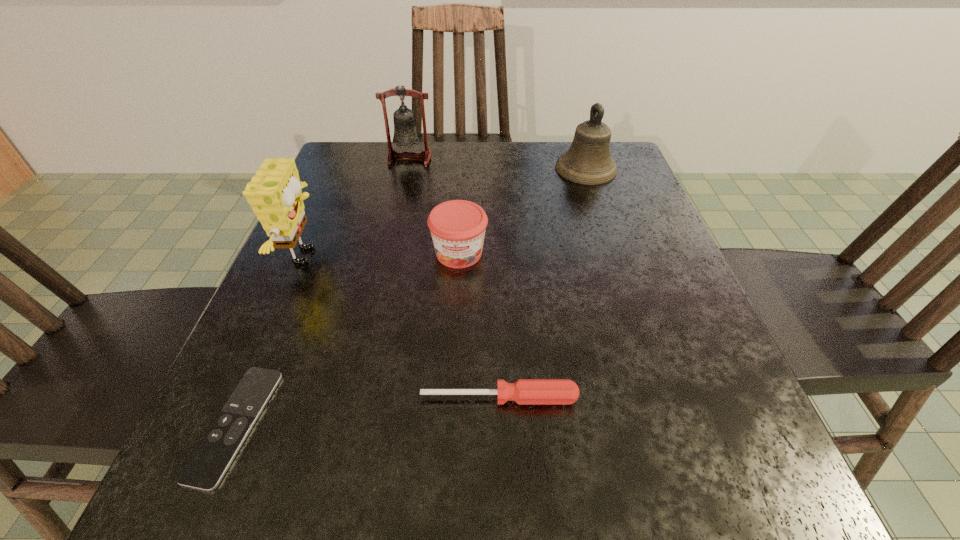
This screenshot has height=540, width=960. I want to click on the fourth object from right to left, so click(406, 134).

Identify the location of sponge. (274, 193).

Where is `the right bell`? the right bell is located at coordinates (588, 161).

Image resolution: width=960 pixels, height=540 pixels. Find the location of `jam`. jam is located at coordinates (457, 227).

This screenshot has height=540, width=960. Find the location of `the fifth tallest object`. the fifth tallest object is located at coordinates (524, 391).

In order to click on remote control in this screenshot , I will do `click(205, 468)`.

Locate an element on the screen. This screenshot has height=540, width=960. blank area located 0.190m on the right of the third object from left to right is located at coordinates tap(509, 159).

Identify the location of vacant space situated 0.330m on the front-facing side of the sponge. Image resolution: width=960 pixels, height=540 pixels. (499, 256).

In order to click on vacant point located 0.110m on the left of the rightmost object in this screenshot , I will do `click(511, 168)`.

Identify the location of vacant space located 0.400m on the front label of the fourth tallest object. The height and width of the screenshot is (540, 960). (446, 502).